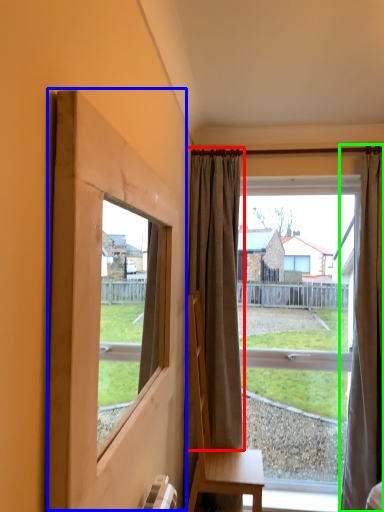
Question: Which object is the closest to the curtain (highlighted by a red box)? Choose among these: window frame (highlighted by a blue box) or curtain (highlighted by a green box).

Choices:
 (A) window frame
 (B) curtain

Answer: (B)